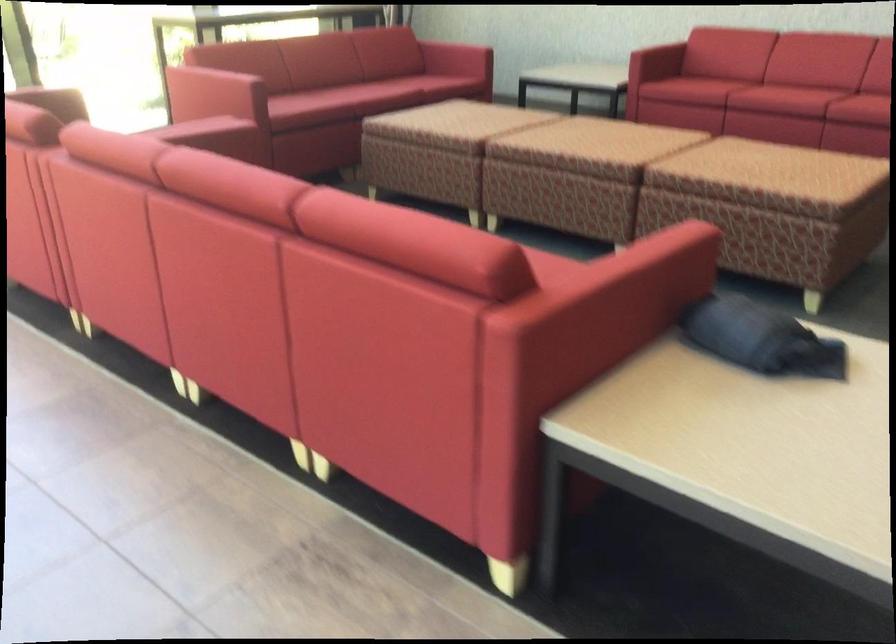
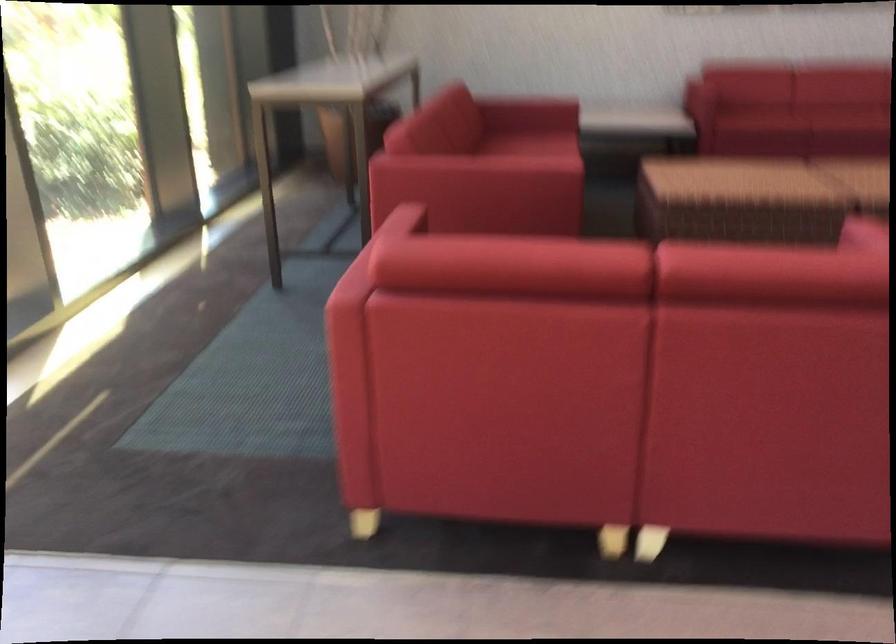
The first image is from the beginning of the video and the second image is from the end. How did the camera likely rotate when shooting the video?

The camera's rotation is toward right-down.